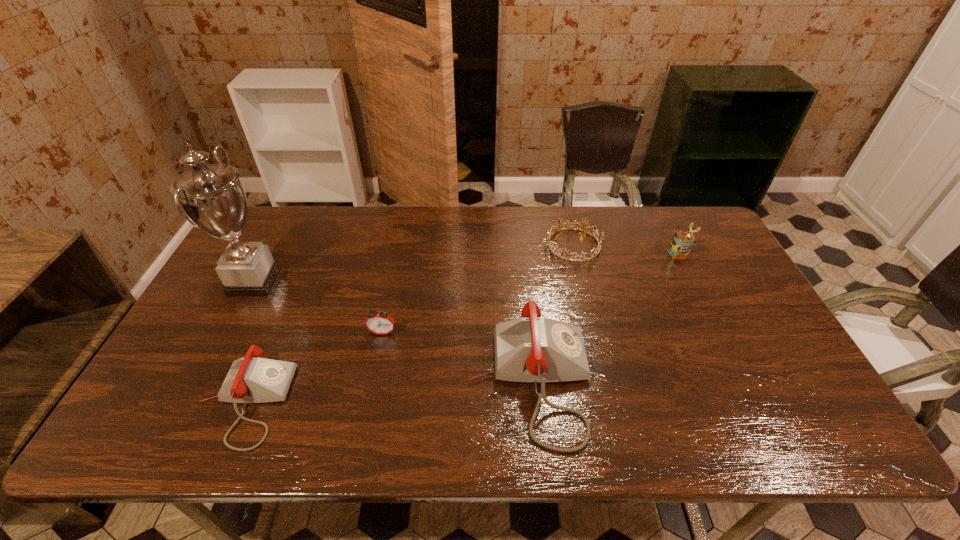
Identify the location of vacant space situated on the front-facing side of the shortest object. (452, 245).

Identify the location of vacant space located on the front-facing side of the shortest object. The image size is (960, 540). (489, 245).

Where is `free location located on the clock face of the alarm clock`? free location located on the clock face of the alarm clock is located at coordinates (373, 375).

This screenshot has width=960, height=540. Identify the location of free region located 0.150m at the front view of the trophy cup. (330, 283).

Identify the location of vacant position located on the left of the can. (631, 253).

You are a GUI agent. You are given a task and a screenshot of the screen. Output one action in this format:
    pyautogui.click(x=<x>, y=<y>)
    Task: Click on the tiara that is at the far edge
    
    Given the screenshot: What is the action you would take?
    pyautogui.click(x=548, y=236)

Find the location of a particular element. The height and width of the screenshot is (540, 960). can located at the far edge is located at coordinates (682, 242).

Locate an element on the screen. This screenshot has width=960, height=540. telephone at the left edge is located at coordinates (252, 379).

You are a GUI agent. You are given a task and a screenshot of the screen. Output one action in this format:
    pyautogui.click(x=<x>, y=<y>)
    Task: Click on the trophy cup that is positioned at the left edge
    The width and height of the screenshot is (960, 540).
    Given the screenshot: What is the action you would take?
    pyautogui.click(x=213, y=197)

At what (x,y) coordinates should I click in order to perform the action: click on object that is at the right edge. Please return your answer as a coordinate pair (x, y). The image size is (960, 540). Looking at the image, I should click on (682, 242).